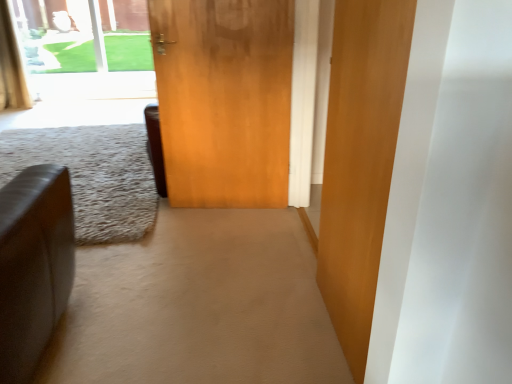
Question: Visually, is wooden door at center, placed as the first door when sorted from back to front, positioned to the left or to the right of wooden door at center, acting as the 2th door starting from the left?

Choices:
 (A) left
 (B) right

Answer: (A)

Question: Is wooden door at center, placed as the 1th door when sorted from left to right, spatially inside wooden door at center, acting as the 2th door starting from the left, or outside of it?

Choices:
 (A) inside
 (B) outside

Answer: (B)

Question: Based on their relative distances, which object is nearer to the wooden door at center, placed as the first door when sorted from back to front?

Choices:
 (A) leather couch at left
 (B) transparent glass window at upper left
 (C) wooden door at center, acting as the second door starting from the back
 (D) gold textured curtain at upper left

Answer: (A)

Question: Estimate the real-world distances between objects in this image. Which object is closer to the leather couch at left?

Choices:
 (A) gold textured curtain at upper left
 (B) wooden door at center, placed as the 1th door when sorted from left to right
 (C) transparent glass window at upper left
 (D) wooden door at center, which is the 1th door in right-to-left order

Answer: (B)